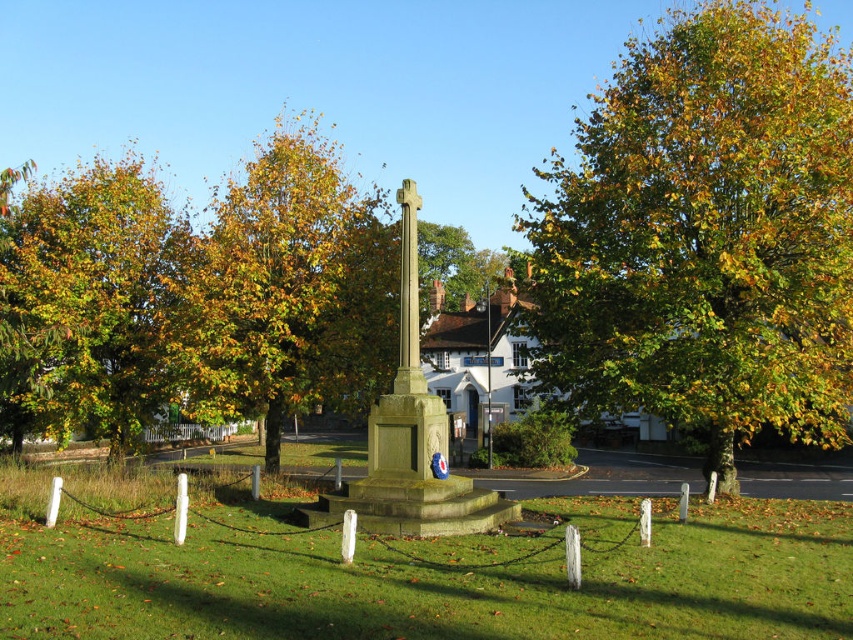
Question: Which point is closer to the camera?

Choices:
 (A) (637, 93)
 (B) (120, 380)
 (C) (416, 198)

Answer: (C)

Question: Can you confirm if yellow-green leaves at upper right is thinner than golden leafy tree at left?

Choices:
 (A) yes
 (B) no

Answer: (B)

Question: Is yellow-green leaves at upper right thinner than golden leaves at center?

Choices:
 (A) no
 (B) yes

Answer: (A)

Question: Is golden leaves at center to the left of golden leafy tree at left from the viewer's perspective?

Choices:
 (A) yes
 (B) no

Answer: (B)

Question: Which of the following is the closest to the observer?

Choices:
 (A) (210, 275)
 (B) (410, 259)
 (C) (791, 145)
 (D) (434, 448)

Answer: (D)

Question: Which point appears closest to the camera in this image?

Choices:
 (A) (405, 294)
 (B) (375, 218)
 (C) (119, 312)

Answer: (A)